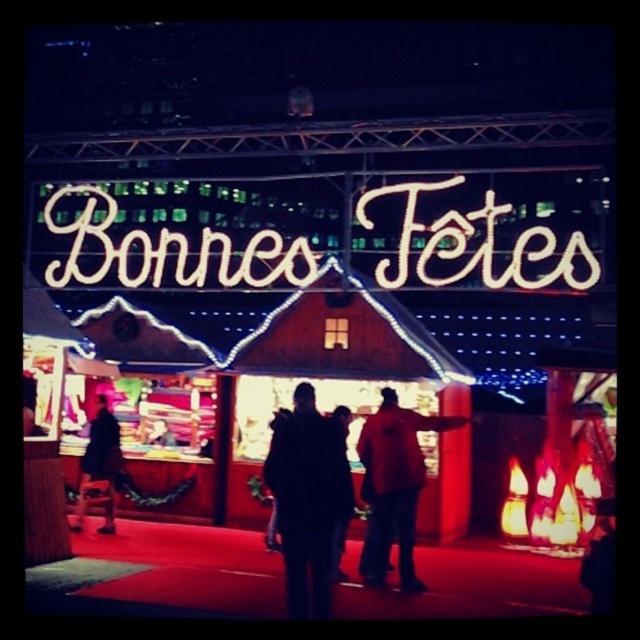
Does dark fabric jacket at center have a lesser height compared to red matte jacket at center?

Incorrect, dark fabric jacket at center's height does not fall short of red matte jacket at center's.

Does dark fabric jacket at center appear over red matte jacket at center?

Correct, dark fabric jacket at center is located above red matte jacket at center.

Find the location of a particular element. The width and height of the screenshot is (640, 640). dark fabric jacket at center is located at coordinates (307, 499).

I want to click on dark fabric jacket at center, so click(x=307, y=499).

Which of these two, red matte jacket at center or dark blue jacket at left, stands shorter?

Standing shorter between the two is dark blue jacket at left.

Which is in front, point (419, 451) or point (109, 477)?

Positioned in front is point (419, 451).

In order to click on red matte jacket at center in this screenshot , I will do `click(394, 484)`.

Can you confirm if dark fabric jacket at center is positioned to the right of dark blue jacket at left?

Indeed, dark fabric jacket at center is positioned on the right side of dark blue jacket at left.

Who is positioned more to the right, dark fabric jacket at center or dark blue jacket at left?

Positioned to the right is dark fabric jacket at center.

Is point (312, 560) positioned after point (113, 515)?

No.

This screenshot has height=640, width=640. Identify the location of dark fabric jacket at center. (307, 499).